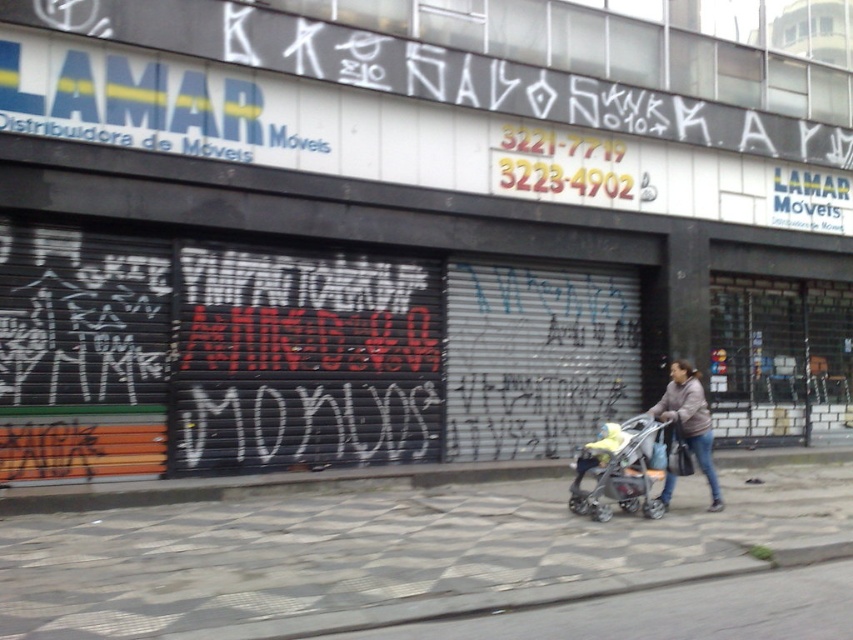
You are standing on the street in front of the Lamar Muebles store. You want to take a photo of the graffiti on the security shutters. To get the best angle, you need to stand exactly at the center of the checkerboard tile pavement at center. Where should you position yourself relative to the store?

You should position yourself at the point marked by the checkerboard tile pavement at center located at coordinates (367, 548) relative to the store to capture the best angle for the photo.

You are standing on the street looking at the Lamar Muebles storefront. You notice the checkerboard tile pavement at center and the brown fuzzy jacket at lower right. Which object is nearer to you?

The checkerboard tile pavement at center is closer to the viewer than the brown fuzzy jacket at lower right.

You are a parent pushing a yellow fabric baby carriage at center along the checkerboard tile pavement at center. Can you tell me which one is taller between the two?

The yellow fabric baby carriage at center is taller than checkerboard tile pavement at center.